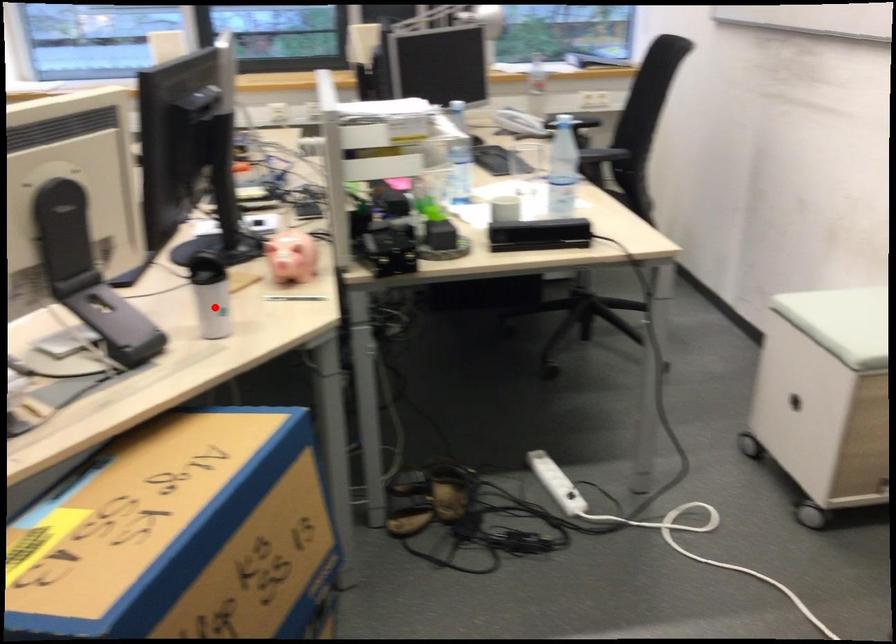
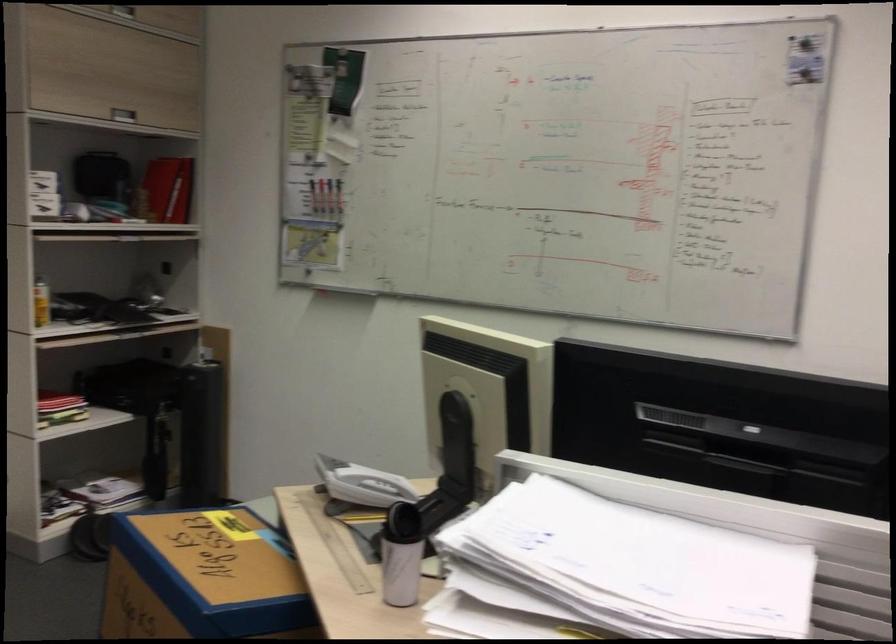
The point at the highlighted location is marked in the first image. Where is the corresponding point in the second image?

(400, 570)